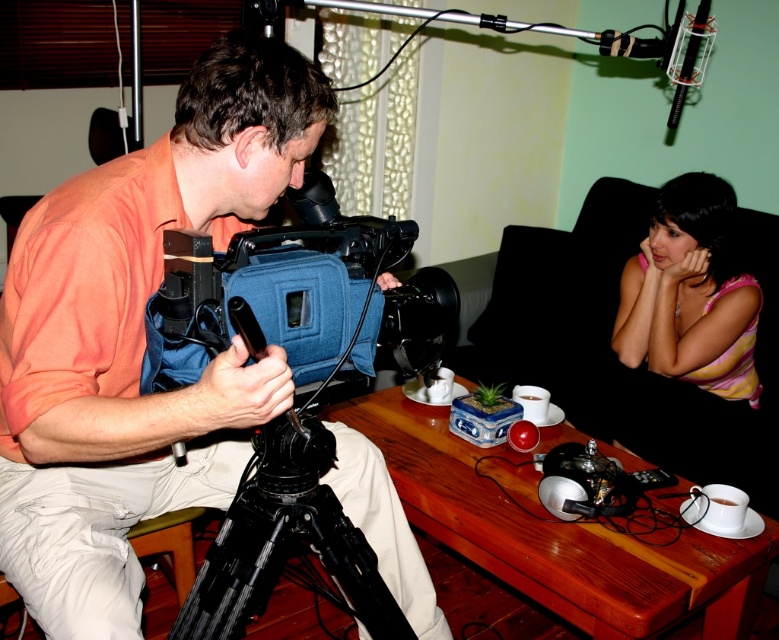
Which is above, orange fabric camera at left or black fabric couch at right?

black fabric couch at right is above.

Between orange fabric camera at left and black fabric couch at right, which one appears on the right side from the viewer's perspective?

black fabric couch at right

Locate an element on the screen. The height and width of the screenshot is (640, 779). orange fabric camera at left is located at coordinates (136, 339).

Does black metal tripod at lower center have a greater width compared to pink striped shirt at upper right?

In fact, black metal tripod at lower center might be narrower than pink striped shirt at upper right.

Based on the photo, who is higher up, black metal tripod at lower center or pink striped shirt at upper right?

pink striped shirt at upper right is above.

Measure the distance between point [233,550] and camera.

A distance of 3.60 feet exists between point [233,550] and camera.

You are a GUI agent. You are given a task and a screenshot of the screen. Output one action in this format:
    pyautogui.click(x=<x>, y=<y>)
    Task: Click on the black metal tripod at lower center
    
    Given the screenshot: What is the action you would take?
    pyautogui.click(x=284, y=540)

Who is higher up, orange fabric camera at left or pink striped shirt at upper right?

pink striped shirt at upper right is higher up.

Is orange fabric camera at left thinner than pink striped shirt at upper right?

No.

Identify the location of orange fabric camera at left. Image resolution: width=779 pixels, height=640 pixels. (136, 339).